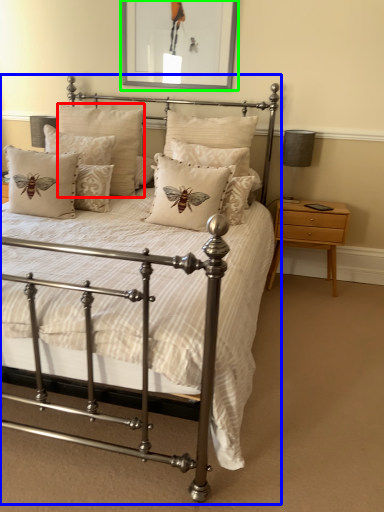
Question: Which object is positioned closest to pillow (highlighted by a red box)? Select from bed (highlighted by a blue box) and picture frame (highlighted by a green box).

Choices:
 (A) bed
 (B) picture frame

Answer: (B)